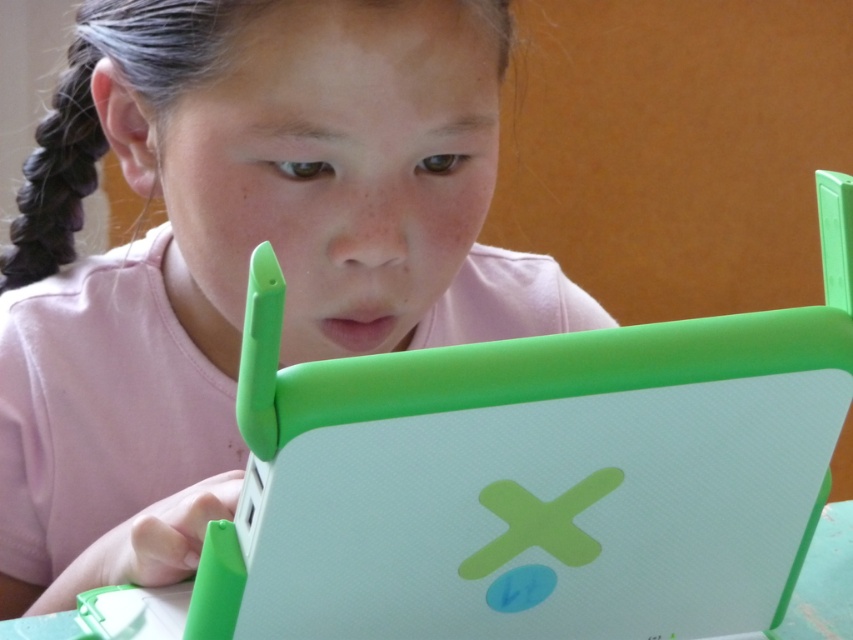
Which of these two, pink matte shirt at center or white matte table at lower center, stands taller?

pink matte shirt at center is taller.

Consider the image. Is pink matte shirt at center smaller than white matte table at lower center?

Actually, pink matte shirt at center might be larger than white matte table at lower center.

Is point (54, 589) less distant than point (16, 632)?

No.

Identify the location of pink matte shirt at center. (236, 253).